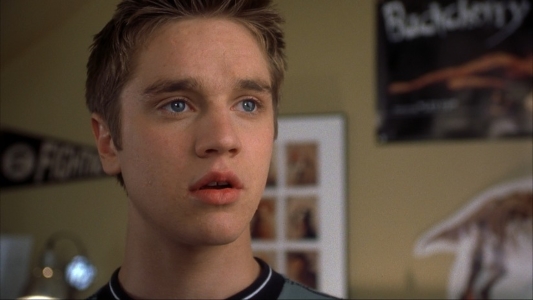
This screenshot has width=533, height=300. Identify the location of large poster. (449, 45).